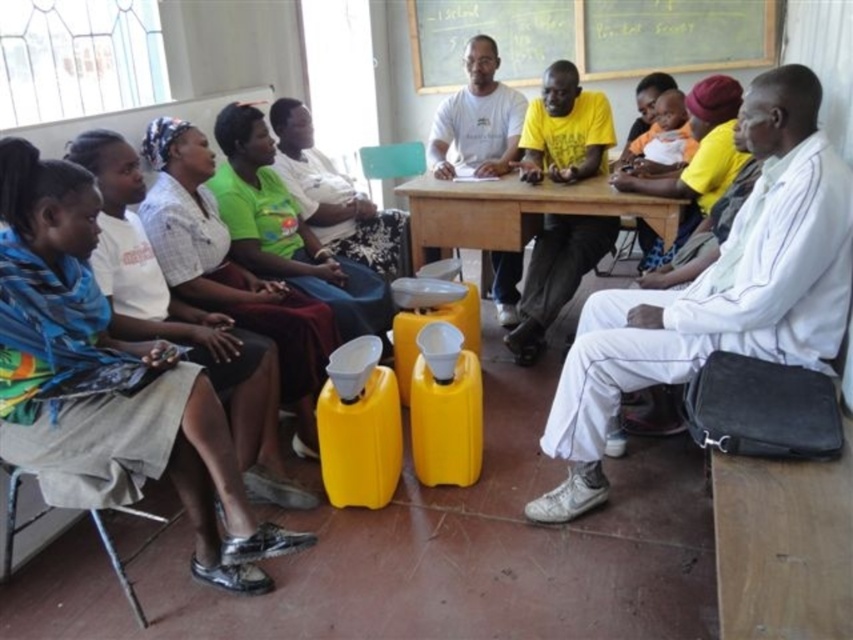
Question: Which point is farther to the camera?

Choices:
 (A) (328, 275)
 (B) (515, 211)

Answer: (B)

Question: Is white fabric bag at right thinner than white cotton shirt at left?

Choices:
 (A) yes
 (B) no

Answer: (B)

Question: Does white cotton shirt at left appear on the left side of green fabric shirt at center?

Choices:
 (A) yes
 (B) no

Answer: (A)

Question: Among these points, which one is nearest to the camera?

Choices:
 (A) pos(242,500)
 (B) pos(512,205)

Answer: (A)

Question: Among these points, which one is nearest to the camera?

Choices:
 (A) tap(271, 163)
 (B) tap(480, 225)
 (C) tap(160, 148)

Answer: (C)

Question: Is white cotton shirt at left wider than wooden table at center?

Choices:
 (A) yes
 (B) no

Answer: (B)